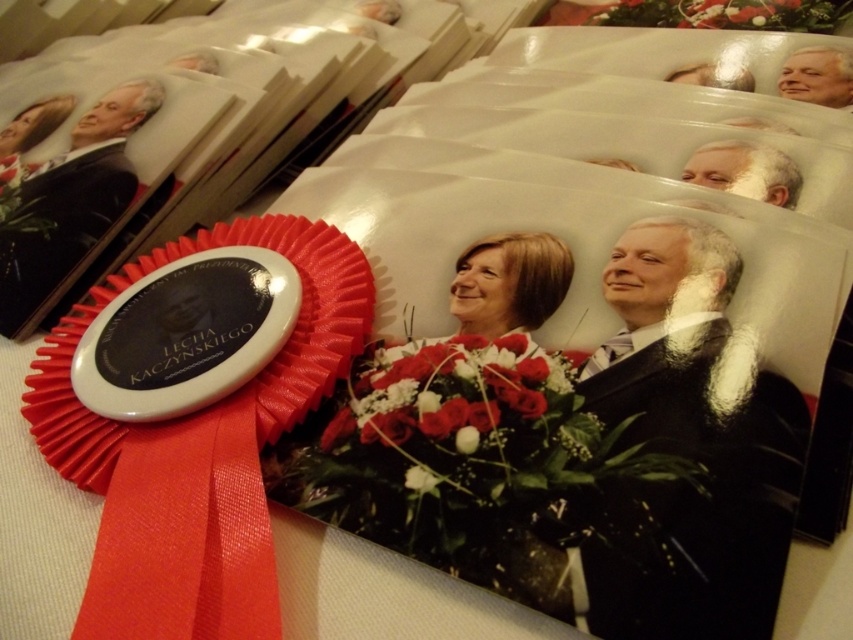
Who is positioned more to the right, red silk flower at center or smooth white face at upper right?

From the viewer's perspective, smooth white face at upper right appears more on the right side.

Can you confirm if red silk flower at center is taller than smooth white face at upper right?

In fact, red silk flower at center may be shorter than smooth white face at upper right.

Measure the distance between red silk flower at center and camera.

They are 61.82 centimeters apart.

Where is `red silk flower at center`? red silk flower at center is located at coordinates (445, 390).

Can you confirm if white textured suit at center is wider than red silk flower at center?

No, white textured suit at center is not wider than red silk flower at center.

Which is more to the left, white textured suit at center or red silk flower at center?

red silk flower at center is more to the left.

Is point (763, 556) closer to camera compared to point (456, 400)?

Yes, it is.

Identify the location of white textured suit at center. (695, 435).

Does red satin ribbon at center come in front of smooth white face at upper right?

Yes, red satin ribbon at center is in front of smooth white face at upper right.

Between point (138, 620) and point (805, 72), which one is positioned in front?

Positioned in front is point (138, 620).

Locate an element on the screen. This screenshot has height=640, width=853. red satin ribbon at center is located at coordinates 198,451.

You are a GUI agent. You are given a task and a screenshot of the screen. Output one action in this format:
    pyautogui.click(x=<x>, y=<y>)
    Task: Click on the red satin ribbon at center
    The height and width of the screenshot is (640, 853).
    Given the screenshot: What is the action you would take?
    pyautogui.click(x=198, y=451)